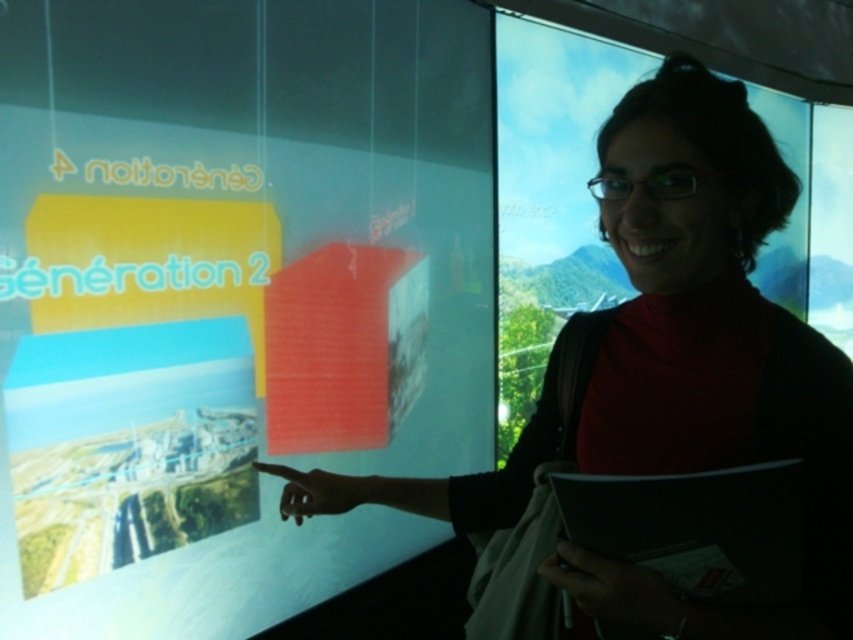
Question: Is matte plastic screen at center further to the viewer compared to matte black sweater at center?

Choices:
 (A) no
 (B) yes

Answer: (B)

Question: Can you confirm if matte plastic screen at center is bigger than matte black sweater at center?

Choices:
 (A) yes
 (B) no

Answer: (A)

Question: Among these objects, which one is farthest from the camera?

Choices:
 (A) matte plastic screen at center
 (B) matte black sweater at center

Answer: (A)

Question: Which of the following is the farthest from the observer?

Choices:
 (A) matte plastic screen at center
 (B) matte black sweater at center

Answer: (A)

Question: Can you confirm if matte plastic screen at center is positioned to the right of matte black sweater at center?

Choices:
 (A) no
 (B) yes

Answer: (A)